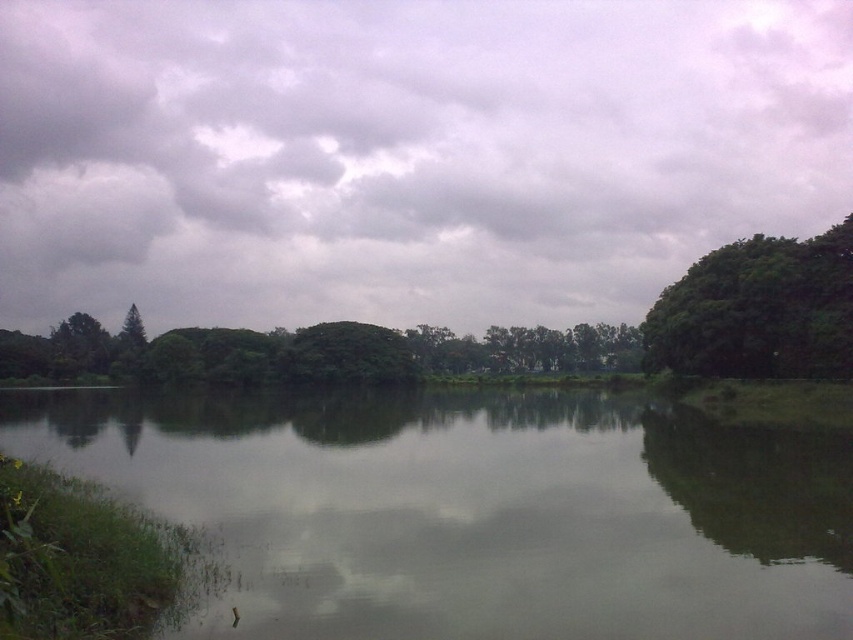
You are standing in the middle of the lake and want to look up at the cloudy sky at upper center. What are the coordinates where you should look?

The cloudy sky at upper center is located at coordinates (404, 154).

You are an artist trying to paint the scene. You need to decide which area to focus on first based on their sizes. Which object should you start with, the cloudy sky at upper center or the green reflective water at center?

The cloudy sky at upper center is larger in size than the green reflective water at center, so you should start with the cloudy sky at upper center to capture its expansive area first.